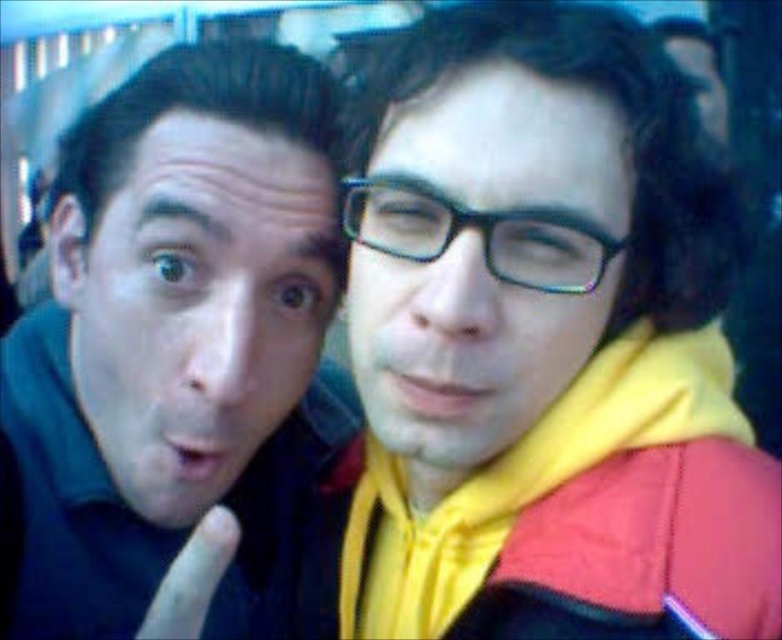
Question: Is matte black shirt at left below black plastic glasses at center?

Choices:
 (A) no
 (B) yes

Answer: (B)

Question: Which object is farther from the camera taking this photo?

Choices:
 (A) matte black shirt at left
 (B) black plastic glasses at center

Answer: (B)

Question: Does matte black shirt at left have a greater width compared to black plastic glasses at center?

Choices:
 (A) yes
 (B) no

Answer: (A)

Question: Is matte black shirt at left wider than black plastic glasses at center?

Choices:
 (A) no
 (B) yes

Answer: (B)